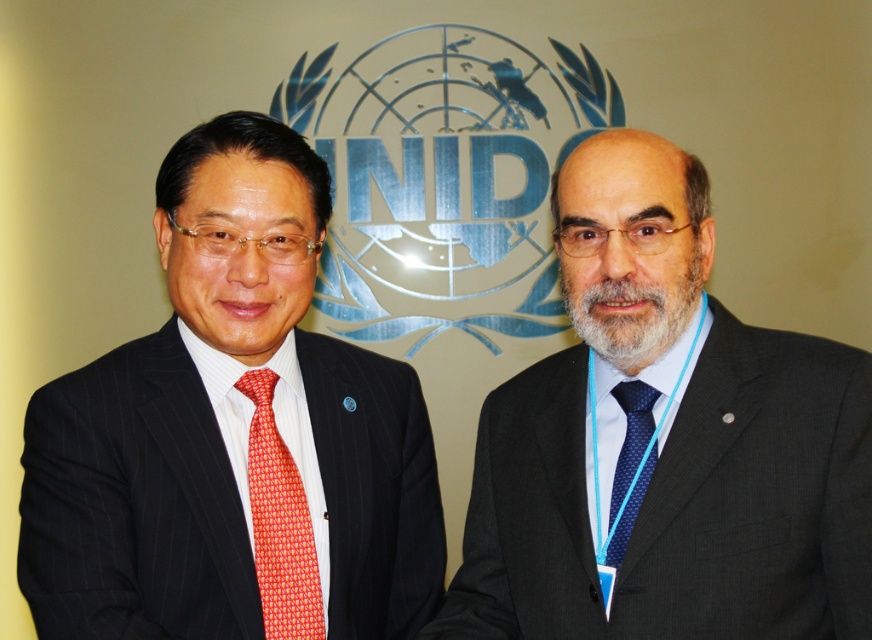
In the scene shown: You are a photographer setting up for a UNIDO event. You need to ensure that the dark gray suit at center and the red silk tie at left are both visible in the frame. Since the UNIDO logo is in the background, which object should you focus on to make sure both are in focus?

The dark gray suit at center is in front of the red silk tie at left, so focusing on the dark gray suit at center will ensure both are in focus as it is closer to the camera.

Consider the image. You are a photographer who needs to adjust the lighting for a group photo. The scene has two people standing against the UNIDO logo backdrop. The dark gray suit at center is represented by point (665, 442). Where should you position the light to ensure the dark gray suit at center is properly illuminated?

The dark gray suit at center is located at point (665, 442), so positioning the light directly in front of this coordinate will ensure proper illumination.